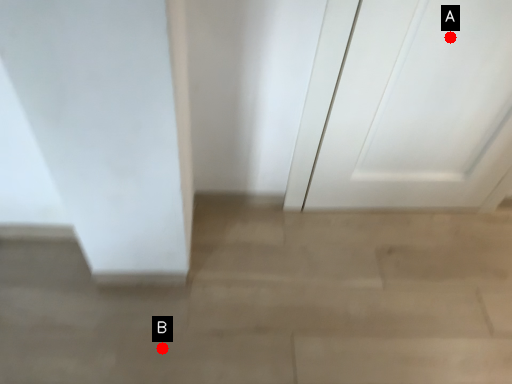
Question: Two points are circled on the image, labeled by A and B beside each circle. Which of the following is the closest to the observer?

Choices:
 (A) A is closer
 (B) B is closer

Answer: (A)